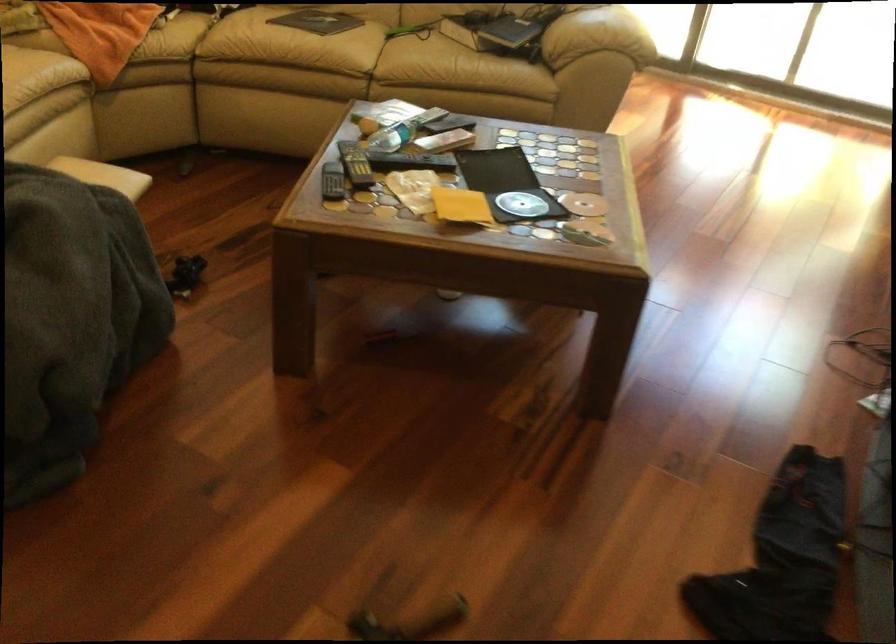
Where would you lift the open DVD case? Please return your answer as a coordinate pair (x, y).

(506, 184)